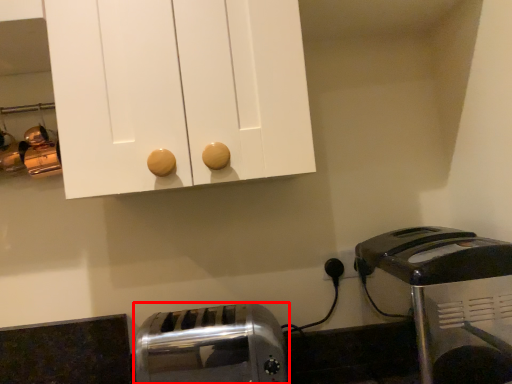
Question: Observing the image, what is the correct spatial positioning of toaster (annotated by the red box) in reference to toaster?

Choices:
 (A) right
 (B) left

Answer: (B)